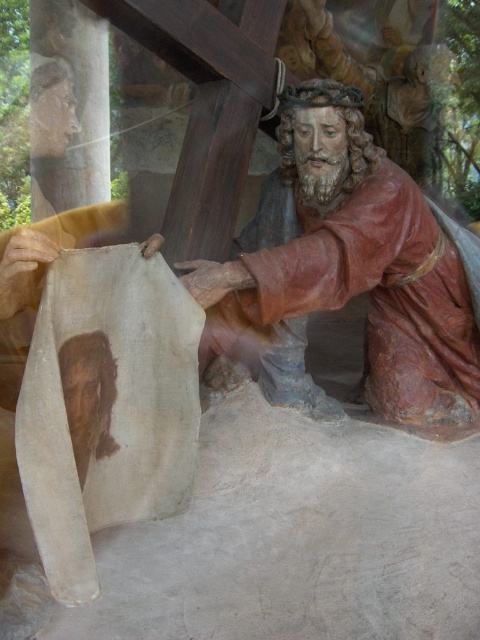
Does point (387, 284) come behind point (84, 336)?

Yes, point (387, 284) is behind point (84, 336).

Is point (427, 400) in front of point (80, 476)?

No, (427, 400) is behind (80, 476).

Is point (319, 205) positioned in front of point (93, 424)?

No, (319, 205) is behind (93, 424).

This screenshot has width=480, height=640. I want to click on wooden statue at center, so click(360, 262).